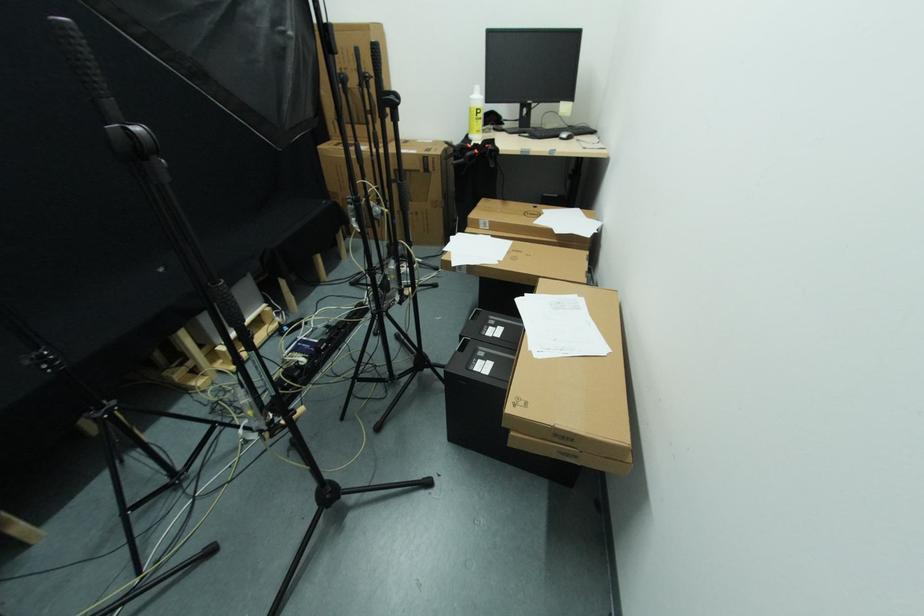
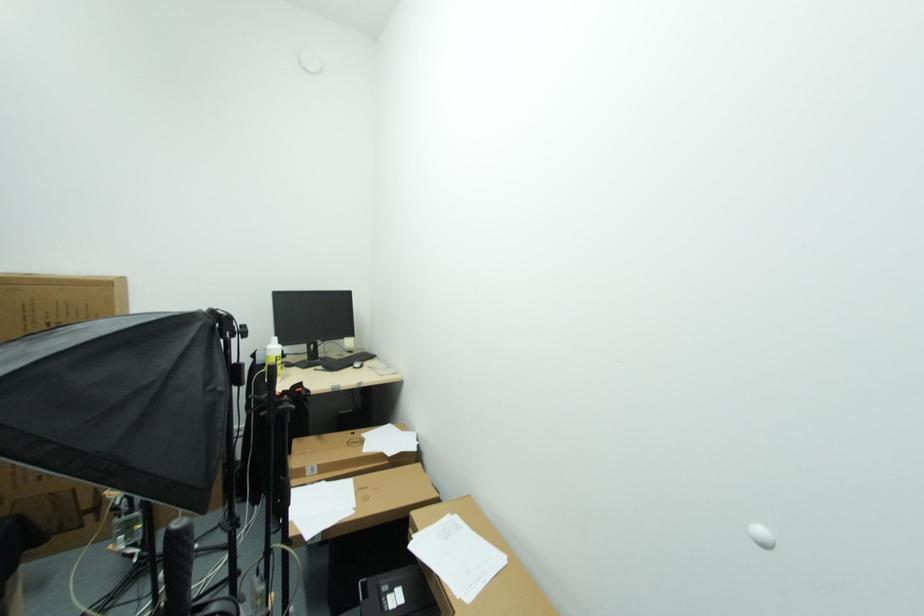
Where in the second image is the point corresponding to the point at 566,138 from the first image?

(359, 368)